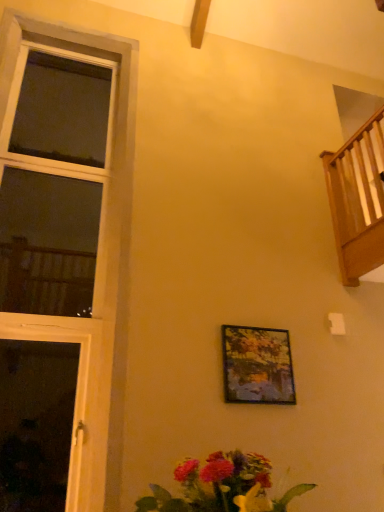
Question: Is wooden railing at upper right not close to wooden window at left?

Choices:
 (A) no
 (B) yes

Answer: (B)

Question: Can you confirm if wooden railing at upper right is wider than wooden window at left?

Choices:
 (A) no
 (B) yes

Answer: (B)

Question: Could you tell me if wooden railing at upper right is turned towards wooden window at left?

Choices:
 (A) no
 (B) yes

Answer: (B)

Question: Is wooden railing at upper right next to wooden window at left?

Choices:
 (A) no
 (B) yes

Answer: (A)

Question: Is wooden railing at upper right to the left of wooden window at left from the viewer's perspective?

Choices:
 (A) no
 (B) yes

Answer: (A)

Question: From the image's perspective, is vibrant bouquet at lower center located above or below metallic gold picture frame at center?

Choices:
 (A) below
 (B) above

Answer: (A)

Question: Is vibrant bouquet at lower center wider or thinner than metallic gold picture frame at center?

Choices:
 (A) thin
 (B) wide

Answer: (B)

Question: Does point (190, 477) appear closer or farther from the camera than point (251, 357)?

Choices:
 (A) closer
 (B) farther

Answer: (A)

Question: Is vibrant bouquet at lower center to the left or to the right of metallic gold picture frame at center in the image?

Choices:
 (A) left
 (B) right

Answer: (A)

Question: Considering the positions of vibrant bouquet at lower center and wooden window at left in the image, is vibrant bouquet at lower center wider or thinner than wooden window at left?

Choices:
 (A) wide
 (B) thin

Answer: (A)

Question: Considering the positions of vibrant bouquet at lower center and wooden window at left in the image, is vibrant bouquet at lower center taller or shorter than wooden window at left?

Choices:
 (A) tall
 (B) short

Answer: (B)

Question: Is vibrant bouquet at lower center to the left or to the right of wooden window at left in the image?

Choices:
 (A) right
 (B) left

Answer: (A)

Question: Is vibrant bouquet at lower center bigger or smaller than wooden window at left?

Choices:
 (A) small
 (B) big

Answer: (A)

Question: Is wooden railing at upper right to the left or to the right of wooden window at left in the image?

Choices:
 (A) left
 (B) right

Answer: (B)

Question: Is wooden railing at upper right wider or thinner than wooden window at left?

Choices:
 (A) wide
 (B) thin

Answer: (A)